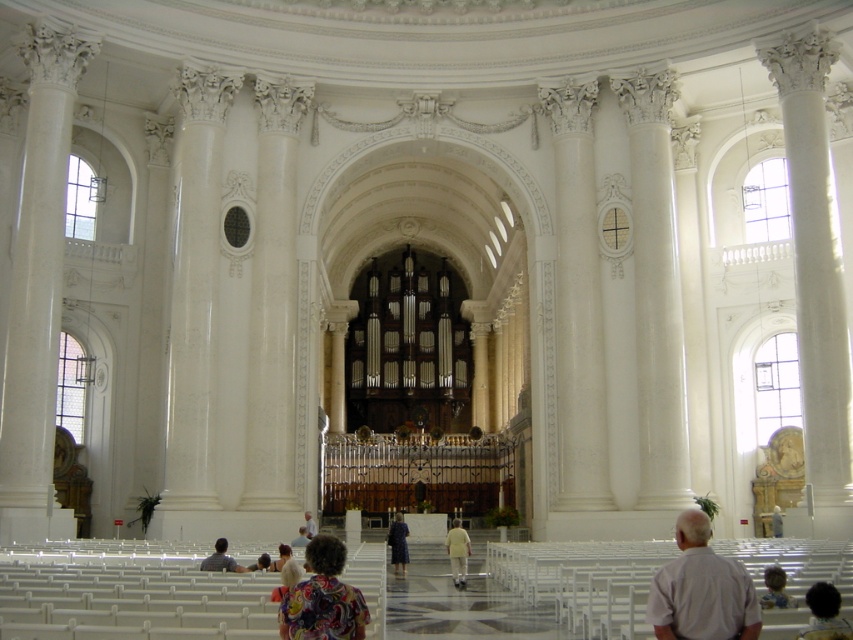
Is point (461, 528) farther from camera compared to point (776, 573)?

Yes, point (461, 528) is farther from viewer.

Is light beige fabric pants at center positioned before light brown hair at lower right?

No, it is not.

Is point (459, 532) farther from viewer compared to point (763, 598)?

Yes, point (459, 532) is behind point (763, 598).

Find the location of a particular element. The image size is (853, 640). light beige fabric pants at center is located at coordinates (457, 552).

Does light brown hair at lower right appear under dark blue fabric coat at center?

No.

Is point (769, 604) positioned behind point (399, 532)?

That is False.

Image resolution: width=853 pixels, height=640 pixels. Describe the element at coordinates (775, 589) in the screenshot. I see `light brown hair at lower right` at that location.

You are a GUI agent. You are given a task and a screenshot of the screen. Output one action in this format:
    pyautogui.click(x=<x>, y=<y>)
    Task: Click on the light brown hair at lower right
    The image size is (853, 640).
    Given the screenshot: What is the action you would take?
    pyautogui.click(x=775, y=589)

Does point (405, 554) come closer to viewer compared to point (250, 564)?

No, (405, 554) is behind (250, 564).

Is dark blue fabric coat at center bigger than floral fabric dress at lower center?

Indeed, dark blue fabric coat at center has a larger size compared to floral fabric dress at lower center.

Identify the location of dark blue fabric coat at center. (398, 541).